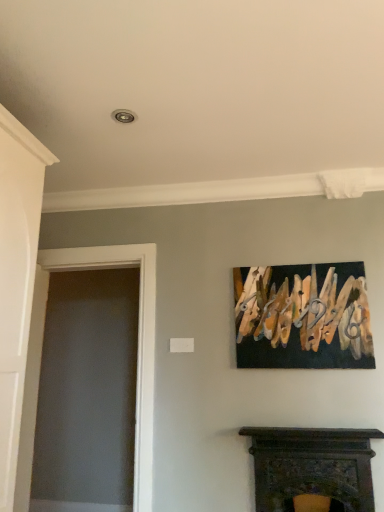
Question: Is point (352, 342) positioned closer to the camera than point (16, 223)?

Choices:
 (A) closer
 (B) farther

Answer: (B)

Question: Considering the positions of wooden clothespins at upper right and white painted wood door at left in the image, is wooden clothespins at upper right taller or shorter than white painted wood door at left?

Choices:
 (A) tall
 (B) short

Answer: (B)

Question: Which object is positioned closest to the white painted wood door at left?

Choices:
 (A) wooden clothespins at upper right
 (B) transparent glass door at left
 (C) dark wood fireplace at lower center

Answer: (B)

Question: Estimate the real-world distances between objects in this image. Which object is farther from the wooden clothespins at upper right?

Choices:
 (A) transparent glass door at left
 (B) dark wood fireplace at lower center
 (C) white painted wood door at left

Answer: (C)